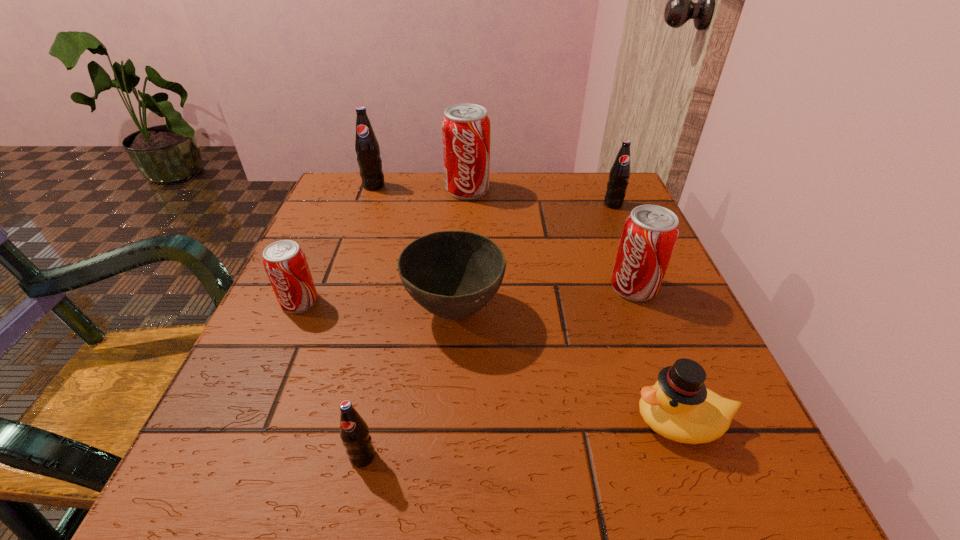
You are a GUI agent. You are given a task and a screenshot of the screen. Output one action in this format:
    pyautogui.click(x=<x>, y=<y>)
    Task: Click on the vacant area that lies between the second red soda can from left to right and the biggest black pop
    The width and height of the screenshot is (960, 540).
    Given the screenshot: What is the action you would take?
    pyautogui.click(x=420, y=187)

This screenshot has width=960, height=540. Find the location of `vacant area that lies between the farthest black pop and the duck`. vacant area that lies between the farthest black pop and the duck is located at coordinates (527, 303).

Identify which object is the fifth closest to the brown bowl. Please provide its 2D coordinates. Your answer should be formatted as a tuple, i.e. [(x, y)], where the tuple contains the x and y coordinates of a point satisfying the conditions above.

[(465, 127)]

Image resolution: width=960 pixels, height=540 pixels. In order to click on object that is the fifth closest to the bowl in this screenshot , I will do `click(465, 127)`.

The width and height of the screenshot is (960, 540). Find the location of `the closest pop to the leftmost red soda can`. the closest pop to the leftmost red soda can is located at coordinates (354, 432).

Where is `pop that is the fifth closest to the farthest black pop`? pop that is the fifth closest to the farthest black pop is located at coordinates (354, 432).

Locate an element on the screen. red soda can identified as the third closest to the leftmost black pop is located at coordinates (650, 232).

This screenshot has height=540, width=960. I want to click on red soda can that is the nearest to the leftmost red soda can, so click(x=465, y=127).

Identify the location of black pop that stands as the second closest to the second biggest red soda can. The width and height of the screenshot is (960, 540). (354, 432).

Choose which black pop is the nearest neighbor to the yellow duck. Please provide its 2D coordinates. Your answer should be formatted as a tuple, i.e. [(x, y)], where the tuple contains the x and y coordinates of a point satisfying the conditions above.

[(354, 432)]